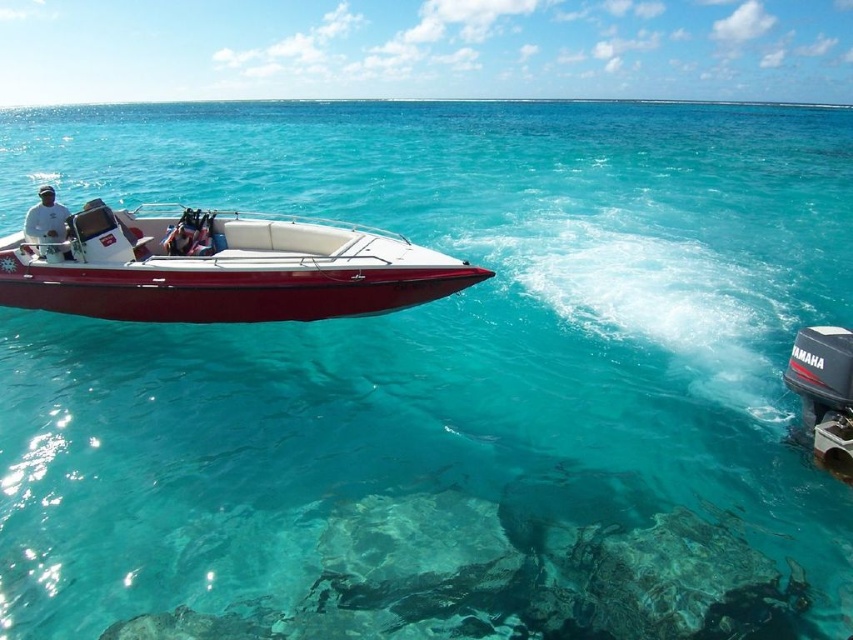
You are standing on the deck of the red speedboat and want to take a photo of the point at coordinates (x=843, y=376). If your camera has a maximum range of 20 feet, will you be able to capture that point in your photo?

The point at coordinates (x=843, y=376) is 20.02 feet away from the camera, which exceeds the camera maximum range of 20 feet. Therefore, you will not be able to capture that point in your photo.

You are a photographer trying to capture the glossy fiberglass speedboat at left and the white matte shirt at left in the same frame. Which object should you zoom in on to ensure both are in focus without moving the camera?

The glossy fiberglass speedboat at left is thinner than the white matte shirt at left, so zooming in on the speedboat will help keep both in focus as it is closer to the camera.